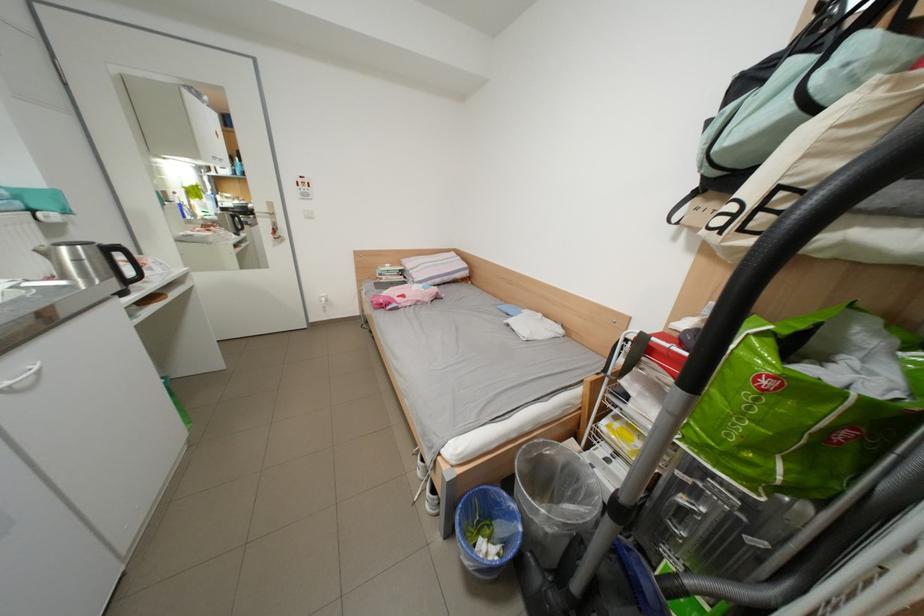
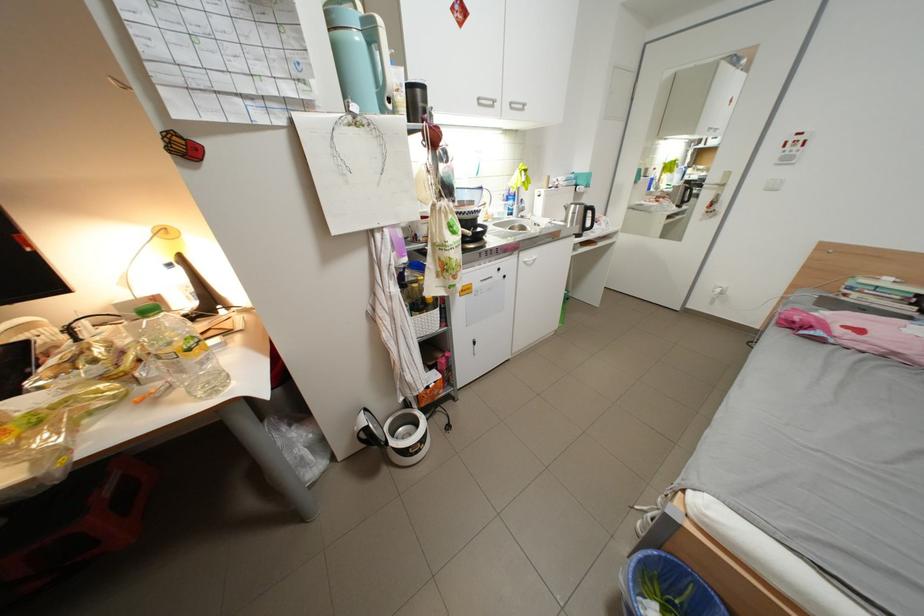
In the second image, find the point that corresponds to the point at 90,262 in the first image.

(585, 215)